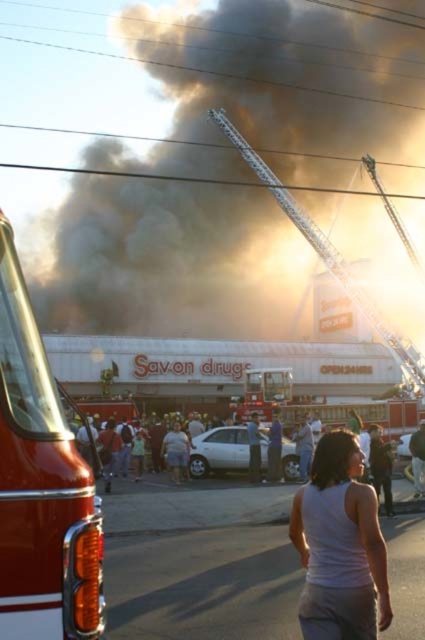
Based on the photo, is metallic silver fire truck at center below white cotton shirt at center?

No, metallic silver fire truck at center is not below white cotton shirt at center.

Is metallic silver fire truck at center in front of white cotton shirt at center?

No.

Who is more distant from viewer, (x=323, y=256) or (x=252, y=445)?

Point (x=323, y=256)

This screenshot has height=640, width=425. Identify the location of metallic silver fire truck at center. (328, 257).

Can you confirm if shiny red fire truck at left is thinner than white cotton shirt at center?

No, shiny red fire truck at left is not thinner than white cotton shirt at center.

Who is taller, shiny red fire truck at left or white cotton shirt at center?

shiny red fire truck at left

Is point (16, 253) closer to camera compared to point (251, 433)?

Yes, it is.

Where is `shiny red fire truck at left`? The height and width of the screenshot is (640, 425). shiny red fire truck at left is located at coordinates (x=40, y=484).

Is shiny red fire truck at left to the left of smooth white tank top at center from the viewer's perspective?

Correct, you'll find shiny red fire truck at left to the left of smooth white tank top at center.

Find the location of a particular element. The height and width of the screenshot is (640, 425). shiny red fire truck at left is located at coordinates (40, 484).

Who is more forward, (64, 516) or (419, 458)?

Point (64, 516)

Locate an element on the screen. Image resolution: width=425 pixels, height=640 pixels. shiny red fire truck at left is located at coordinates (40, 484).